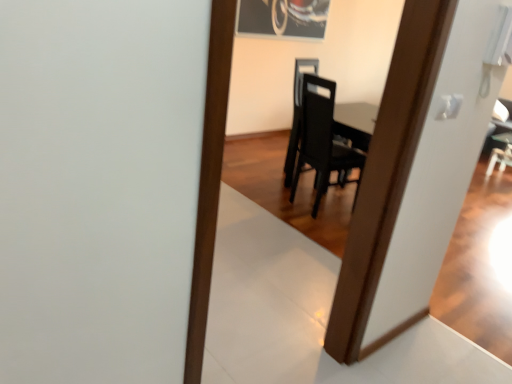
Locate an element on the screen. The image size is (512, 384). metallic silver picture frame at upper center is located at coordinates click(x=283, y=18).

This screenshot has width=512, height=384. Describe the element at coordinates (283, 18) in the screenshot. I see `metallic silver picture frame at upper center` at that location.

Measure the distance between point (x=261, y=12) and camera.

Point (x=261, y=12) is 14.57 feet away from camera.

This screenshot has width=512, height=384. Describe the element at coordinates (322, 142) in the screenshot. I see `black matte chair at center` at that location.

Identify the location of black matte chair at center. (322, 142).

What is the approximate width of black matte chair at center?

The width of black matte chair at center is 21.75 inches.

Locate an element on the screen. This screenshot has height=384, width=512. metallic silver picture frame at upper center is located at coordinates (283, 18).

Considering the relative positions of black matte chair at center and metallic silver picture frame at upper center in the image provided, is black matte chair at center to the left or to the right of metallic silver picture frame at upper center?

black matte chair at center is to the right of metallic silver picture frame at upper center.

Is black matte chair at center further to camera compared to metallic silver picture frame at upper center?

No, black matte chair at center is closer to the camera.

Between point (320, 184) and point (324, 15), which one is positioned in front?

The point (320, 184) is in front.

From the image's perspective, which is below, black matte chair at center or metallic silver picture frame at upper center?

black matte chair at center appears lower in the image.

From a real-world perspective, which object stands above the other?

metallic silver picture frame at upper center, from a real-world perspective.

Between black matte chair at center and metallic silver picture frame at upper center, which one has larger width?

With larger width is black matte chair at center.

Who is taller, black matte chair at center or metallic silver picture frame at upper center?

black matte chair at center is taller.

Considering the sizes of black matte chair at center and metallic silver picture frame at upper center in the image, is black matte chair at center bigger or smaller than metallic silver picture frame at upper center?

In the image, black matte chair at center appears to be larger than metallic silver picture frame at upper center.

Is black matte chair at center inside the boundaries of metallic silver picture frame at upper center, or outside?

The correct answer is: outside.

Would you consider black matte chair at center to be distant from metallic silver picture frame at upper center?

Indeed, black matte chair at center is not near metallic silver picture frame at upper center.

Based on the photo, could you tell me if black matte chair at center is turned towards metallic silver picture frame at upper center?

No, black matte chair at center does not turn towards metallic silver picture frame at upper center.

How different are the orientations of black matte chair at center and metallic silver picture frame at upper center in degrees?

The angular difference between black matte chair at center and metallic silver picture frame at upper center is 91.7 degrees.

In the scene shown: How distant is black matte chair at center from metallic silver picture frame at upper center?

A distance of 5.03 feet exists between black matte chair at center and metallic silver picture frame at upper center.

Where is `picture frame above the black matte chair at center (from a real-world perspective)`? This screenshot has width=512, height=384. picture frame above the black matte chair at center (from a real-world perspective) is located at coordinates (283, 18).

Would you say metallic silver picture frame at upper center is to the left or to the right of black matte chair at center in the picture?

In the image, metallic silver picture frame at upper center appears on the left side of black matte chair at center.

Is metallic silver picture frame at upper center behind black matte chair at center?

Yes.

Which is in front, point (314, 23) or point (305, 77)?

Point (305, 77)

From the image's perspective, which is below, metallic silver picture frame at upper center or black matte chair at center?

From the image's view, black matte chair at center is below.

From a real-world perspective, who is located lower, metallic silver picture frame at upper center or black matte chair at center?

black matte chair at center is physically lower.

Which object is thinner, metallic silver picture frame at upper center or black matte chair at center?

metallic silver picture frame at upper center is thinner.

Between metallic silver picture frame at upper center and black matte chair at center, which one has more height?

black matte chair at center.

Does metallic silver picture frame at upper center have a smaller size compared to black matte chair at center?

Correct, metallic silver picture frame at upper center occupies less space than black matte chair at center.

Could black matte chair at center be considered to be inside metallic silver picture frame at upper center?

No, black matte chair at center is not inside metallic silver picture frame at upper center.

Are metallic silver picture frame at upper center and black matte chair at center making contact?

There is a gap between metallic silver picture frame at upper center and black matte chair at center.

From the picture: Could you tell me if metallic silver picture frame at upper center is facing black matte chair at center?

No.

Looking at this image, how different are the orientations of metallic silver picture frame at upper center and black matte chair at center in degrees?

There is a 91.7-degree angle between the facing directions of metallic silver picture frame at upper center and black matte chair at center.

Measure the distance from metallic silver picture frame at upper center to black matte chair at center.

metallic silver picture frame at upper center and black matte chair at center are 5.03 feet apart from each other.

Find the location of `chair that appears below the metallic silver picture frame at upper center (from a real-world perspective)`. chair that appears below the metallic silver picture frame at upper center (from a real-world perspective) is located at coordinates (322, 142).

Locate an element on the screen. The image size is (512, 384). picture frame above the black matte chair at center (from the image's perspective) is located at coordinates (283, 18).

The height and width of the screenshot is (384, 512). Find the location of `picture frame behind the black matte chair at center`. picture frame behind the black matte chair at center is located at coordinates (283, 18).